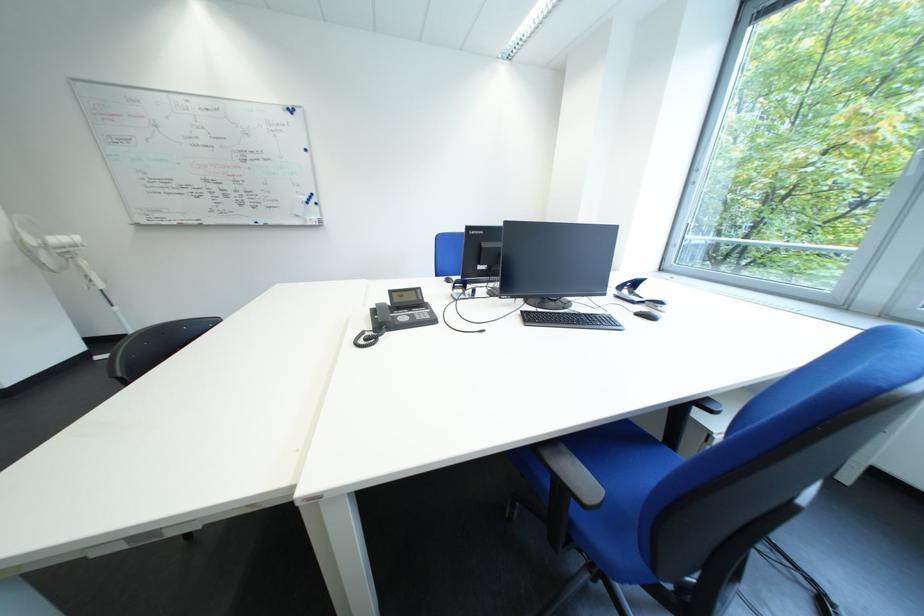
Image resolution: width=924 pixels, height=616 pixels. What do you see at coordinates (590, 474) in the screenshot?
I see `the blue chair sitting surface` at bounding box center [590, 474].